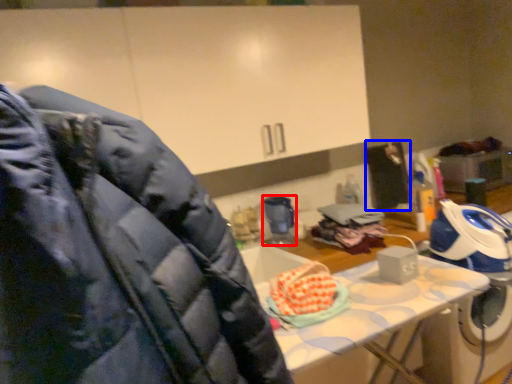
Question: Which object appears farthest to the camera in this image, appliance (highlighted by a red box) or person (highlighted by a blue box)?

Choices:
 (A) appliance
 (B) person

Answer: (B)